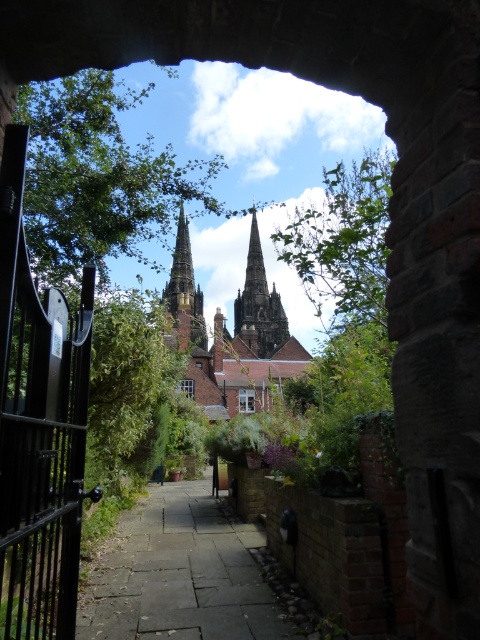
Question: Which object is closer to the camera taking this photo?

Choices:
 (A) black metal gate at left
 (B) gray stone path at center

Answer: (A)

Question: Can you confirm if black metal gate at left is positioned to the right of smooth stone spire at upper center?

Choices:
 (A) yes
 (B) no

Answer: (A)

Question: Which of the following is the farthest from the observer?

Choices:
 (A) gray stone path at center
 (B) black metal gate at left
 (C) brown stone spire at center

Answer: (C)

Question: Does black metal gate at left have a smaller size compared to brown stone spire at center?

Choices:
 (A) yes
 (B) no

Answer: (A)

Question: Among these points, which one is nearest to the camera?

Choices:
 (A) (168, 301)
 (B) (43, 532)

Answer: (B)

Question: Does black metal gate at left appear over brown stone spire at center?

Choices:
 (A) yes
 (B) no

Answer: (B)